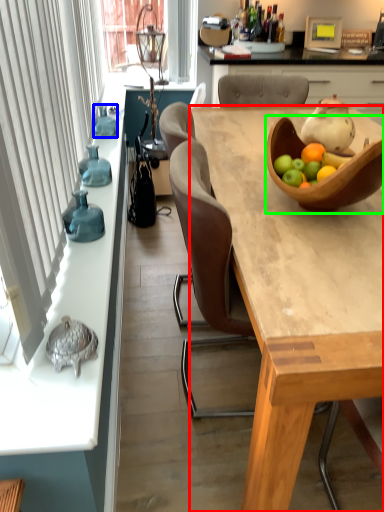
Question: Which object is the closest to the desk (highlighted by a red box)? Choose among these: bottle (highlighted by a blue box) or tableware (highlighted by a green box).

Choices:
 (A) bottle
 (B) tableware

Answer: (B)